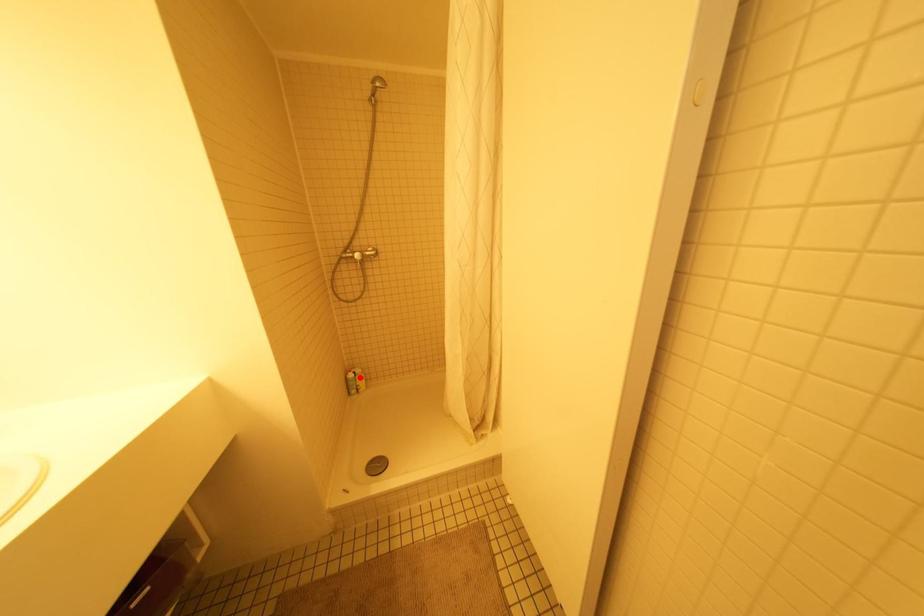
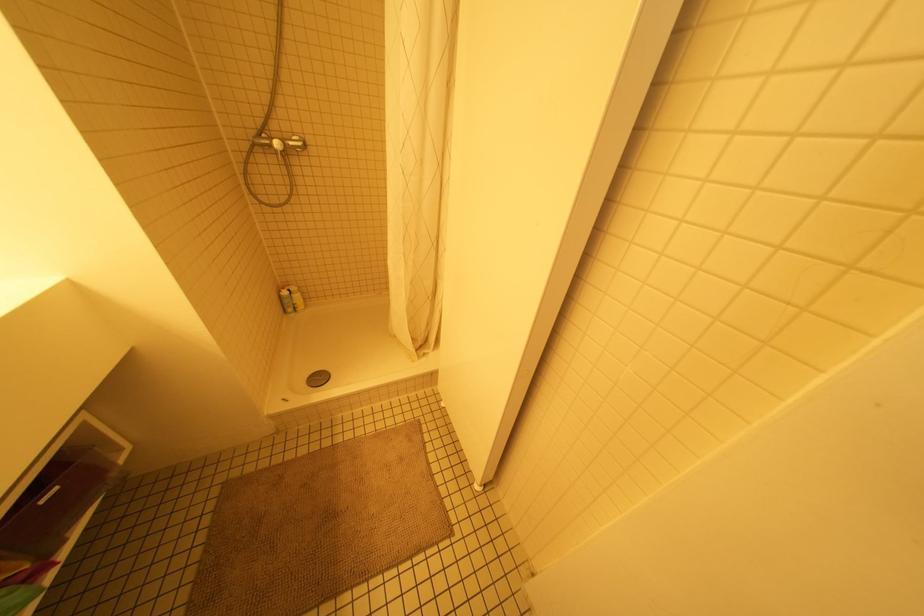
Question: I am providing you with two images of the same scene from different viewpoints. Given a red point in image1, look at the same physical point in image2. Is it:

Choices:
 (A) Closer to the viewpoint
 (B) Farther from the viewpoint

Answer: (A)